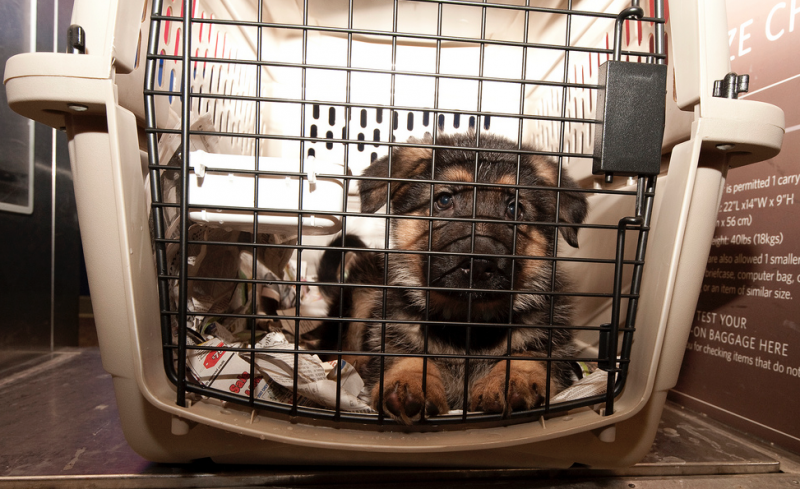
This screenshot has width=800, height=489. Identify the location of wall. (34, 184).